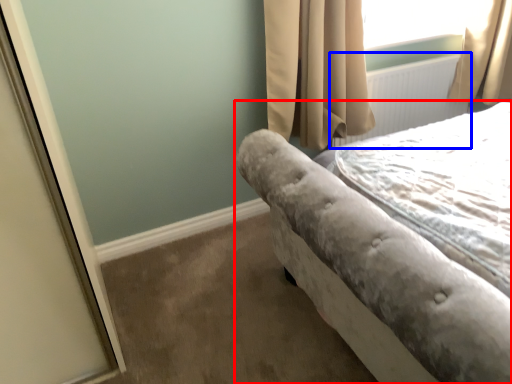
Question: Which of the following is the closest to the observer, bed (highlighted by a red box) or radiator (highlighted by a blue box)?

Choices:
 (A) bed
 (B) radiator

Answer: (A)